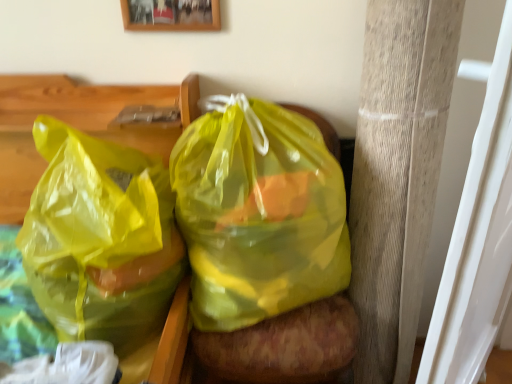
Question: Considering the positions of translucent yellow plastic bag at center, which appears as the 2th plastic bag when viewed from the left, and wooden pillar at right in the image, is translucent yellow plastic bag at center, which appears as the 2th plastic bag when viewed from the left, taller or shorter than wooden pillar at right?

Choices:
 (A) tall
 (B) short

Answer: (B)

Question: Is translucent yellow plastic bag at center, the 1th plastic bag viewed from the right, wider or thinner than wooden pillar at right?

Choices:
 (A) thin
 (B) wide

Answer: (B)

Question: Estimate the real-world distances between objects in this image. Which object is closer to the translucent yellow plastic bag at center, the 1th plastic bag viewed from the right?

Choices:
 (A) translucent yellow plastic bag at left, arranged as the first plastic bag when viewed from the left
 (B) wooden pillar at right
 (C) wooden picture frame at upper center

Answer: (A)

Question: Which object is the closest to the wooden picture frame at upper center?

Choices:
 (A) translucent yellow plastic bag at center, the 1th plastic bag viewed from the right
 (B) wooden pillar at right
 (C) translucent yellow plastic bag at left, arranged as the first plastic bag when viewed from the left

Answer: (A)